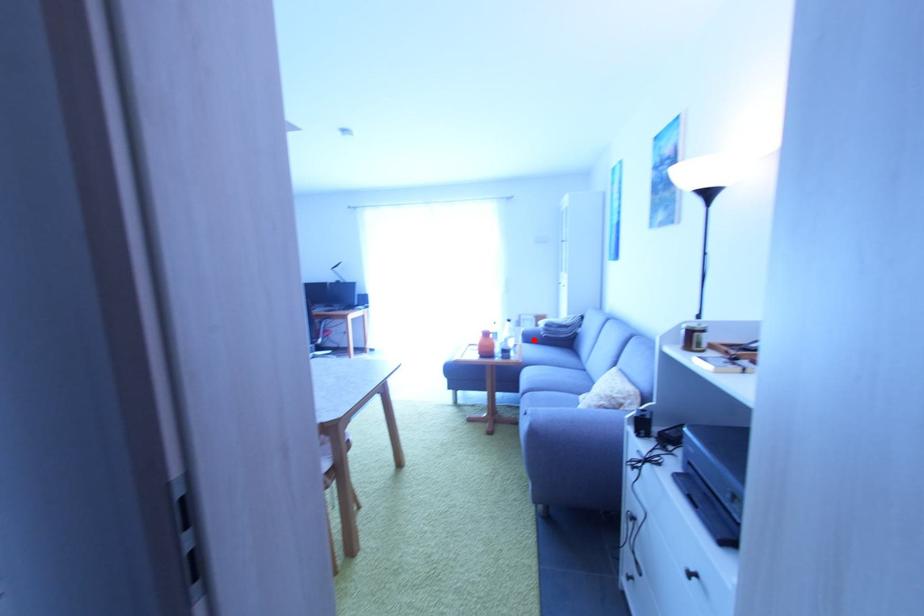
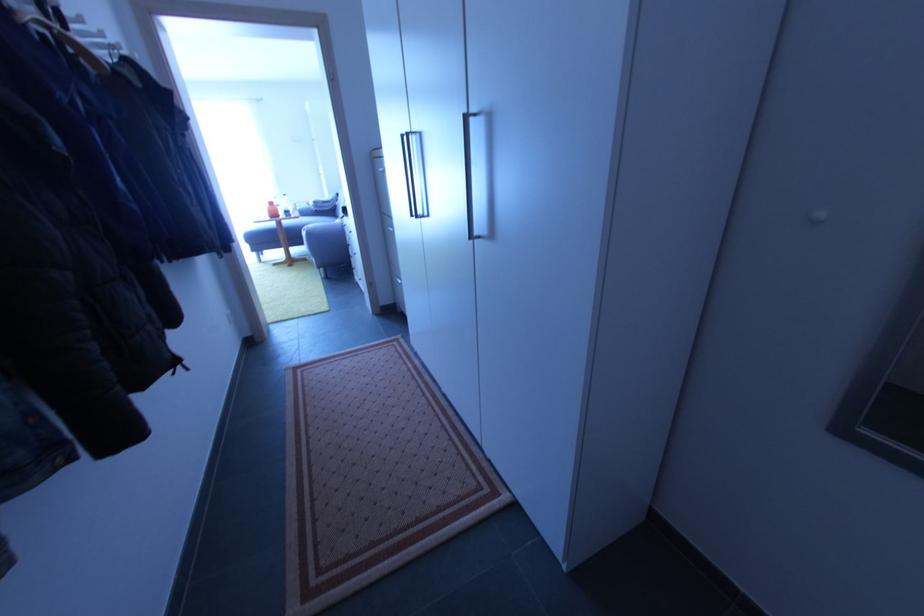
In the second image, find the point that corresponds to the highlighted location in the first image.

(310, 216)